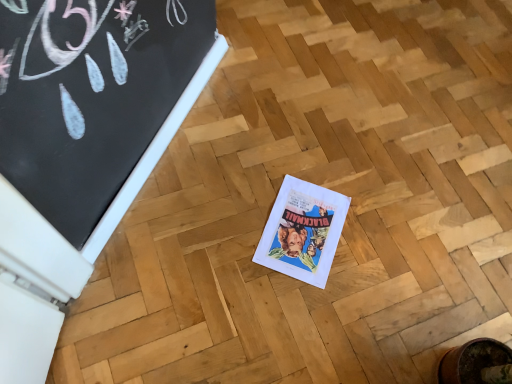
In order to click on free point above black chalkboard at upper left (from a real-world perspective) in this screenshot , I will do coord(147,149).